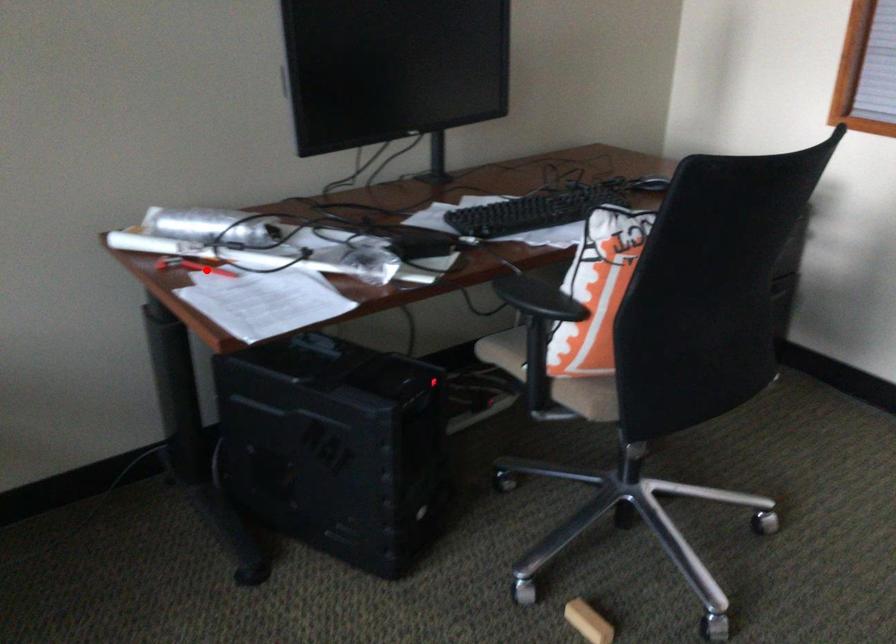
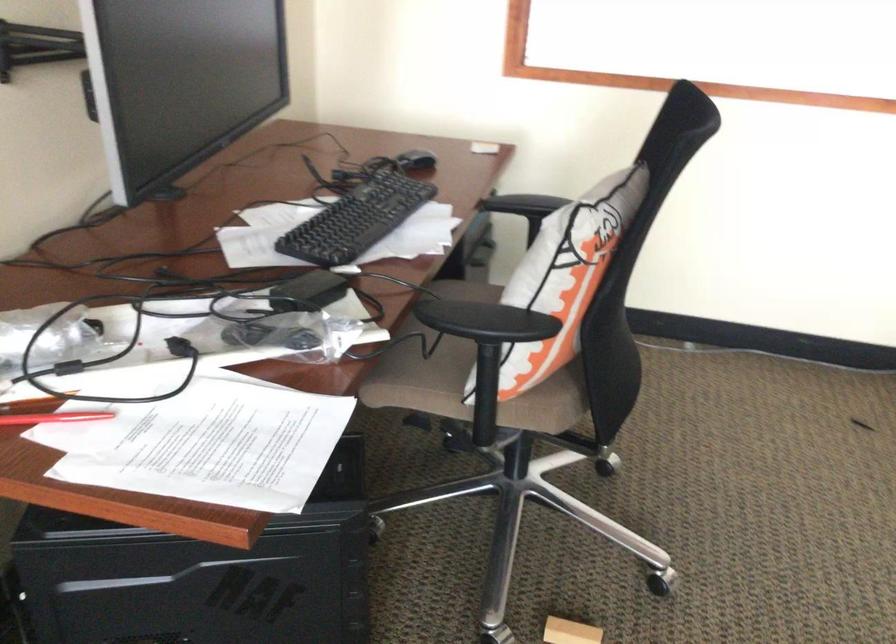
Find the pixel in the second image that matches the highlighted location in the first image.

(54, 418)